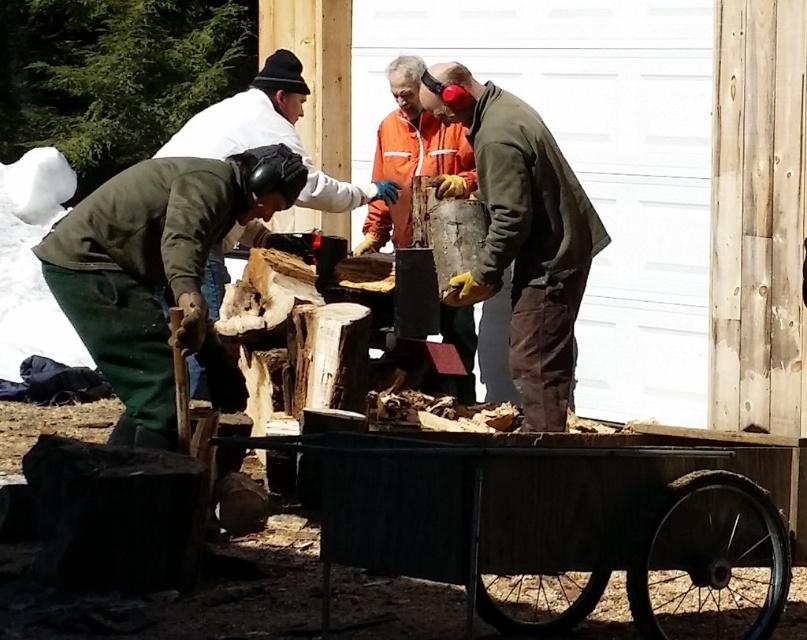
Question: Does rusty metal wagon at lower center have a larger size compared to rusty metal bucket at center?

Choices:
 (A) yes
 (B) no

Answer: (A)

Question: In this image, where is rusty metal wagon at lower center located relative to rusty metal bucket at center?

Choices:
 (A) right
 (B) left

Answer: (A)

Question: Does rusty metal wagon at lower center have a smaller size compared to rusty metal bucket at center?

Choices:
 (A) yes
 (B) no

Answer: (B)

Question: Which point is closer to the camera?

Choices:
 (A) (562, 250)
 (B) (329, 541)

Answer: (B)

Question: Which point is farther to the camera?

Choices:
 (A) rusty metal wagon at lower center
 (B) rusty metal bucket at center

Answer: (B)

Question: Which point is closer to the camera?

Choices:
 (A) (552, 400)
 (B) (601, 497)

Answer: (B)